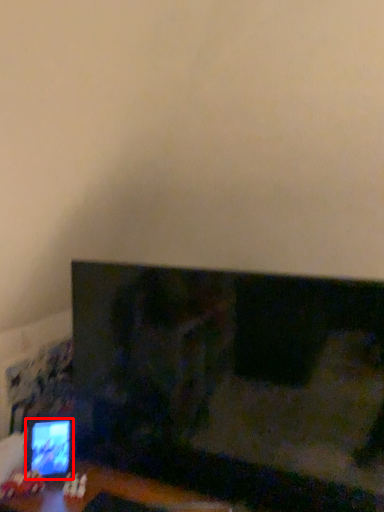
Question: From the image's perspective, considering the relative positions of computer monitor (annotated by the red box) and television in the image provided, where is computer monitor (annotated by the red box) located with respect to the staircase?

Choices:
 (A) above
 (B) below

Answer: (B)